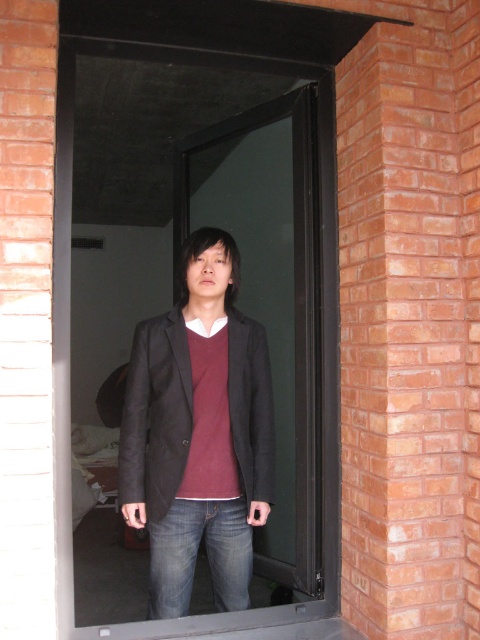
You are a delivery person trying to find the entrance to the building. You see a doorway with red brick walls and a modern black frame. There is a point at coordinates (x=182, y=321). Is this point located on the transparent glass door at center?

The point at coordinates (x=182, y=321) is on the transparent glass door at center, so yes, the point is located on the transparent glass door at center.

You are a delivery person holding a package that is 4 inches thick. You need to pass through the transparent glass door at center while wearing the matte black blazer at center. Can you fit through the space between your blazer and the door without damaging the package?

The transparent glass door at center is 4.16 inches away from the matte black blazer at center. Since the package is 4 inches thick, there is enough space to pass through without damaging the package as 4.16 inches is slightly more than 4 inches.

You are trying to enter the room through the transparent glass door at center. The person wearing the matte black blazer at center is blocking your path. Can you walk around them to reach the door?

The transparent glass door at center is further to the viewer than the matte black blazer at center, so the door is closer to you than the person. Therefore, you cannot walk around them to reach the door because the door is already in front of the person.